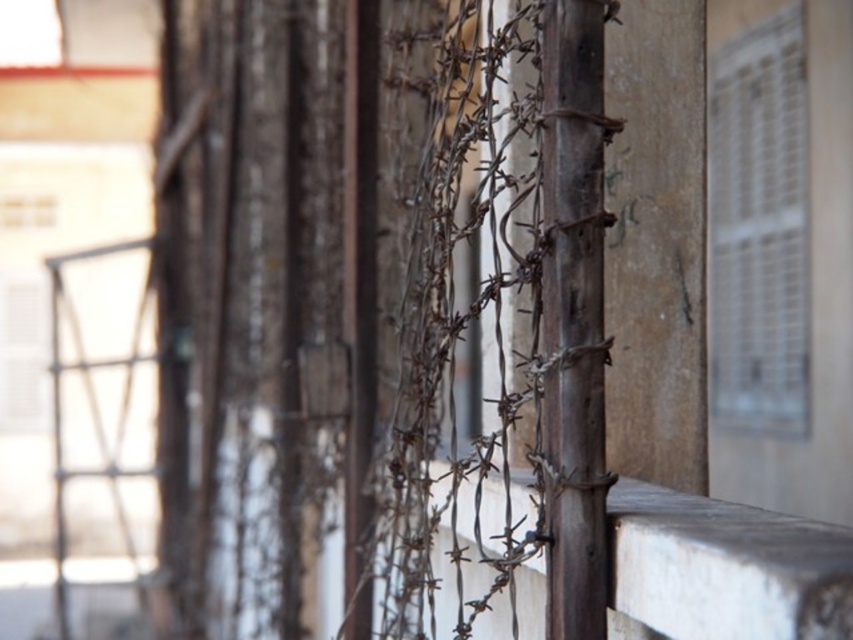
You are a maintenance worker inspecting the fence. You need to access the smooth concrete ledge at center to repair it. Can you reach it without moving the metallic grid at upper right?

The smooth concrete ledge at center is behind the metallic grid at upper right, so you cannot reach it without moving the metallic grid at upper right.

You are an inspector checking the structural integrity of the fence and the grid. Given that the rusty wire fence at center is wider than the metallic grid at upper right, which one would you prioritize for immediate maintenance based on their widths?

The rusty wire fence at center should be prioritized for immediate maintenance because its greater width indicates more material exposure to the elements, leading to higher wear and tear compared to the metallic grid at upper right.

You are standing in front of a weathered wooden fence with barbed wire. There is a specific point marked at coordinates (370, 296). Based on the scene description, where is this point located?

The point at (370, 296) marks the location of the rusty wire fence at center.